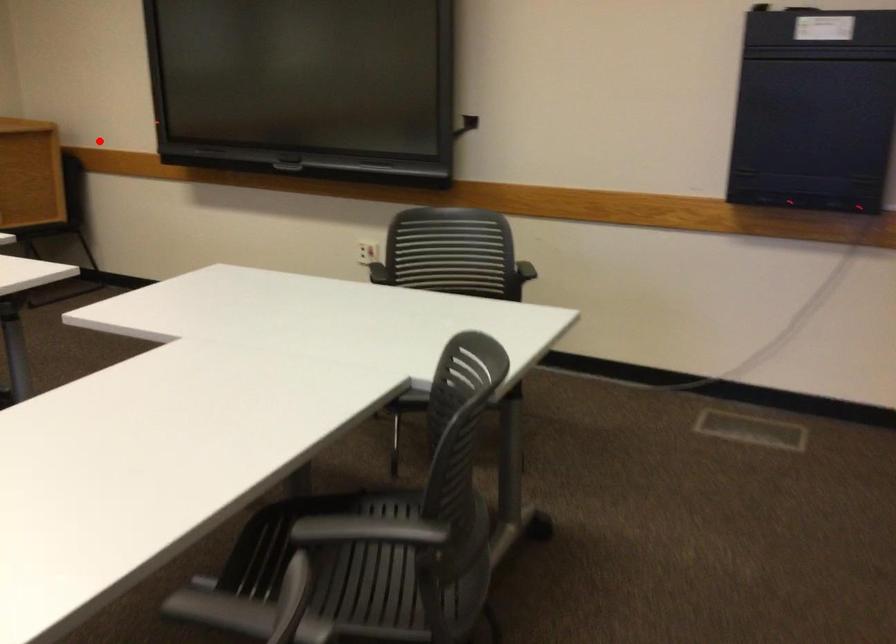
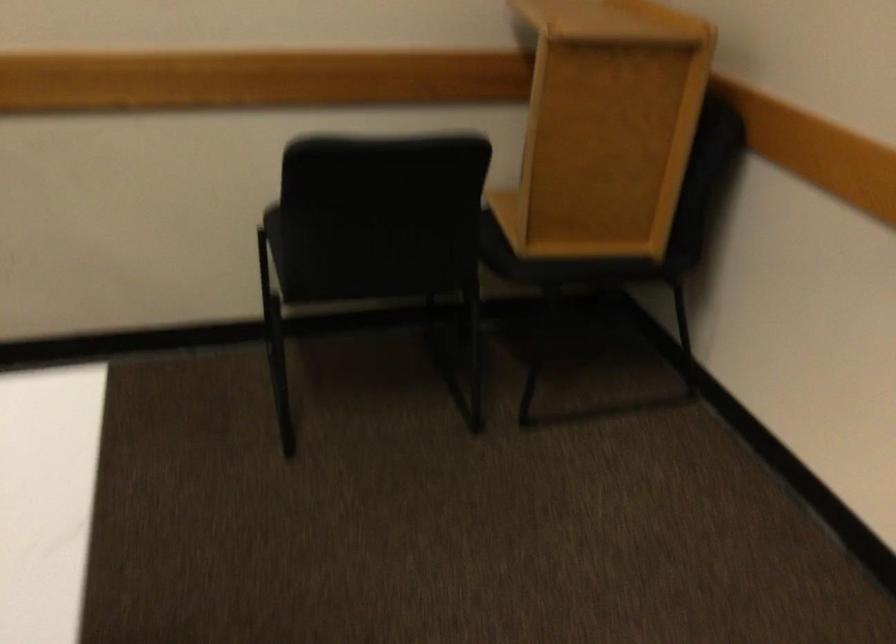
Question: A red point is marked in image1. In image2, is the corresponding 3D point closer to the camera or farther? Reply with the corresponding letter.

Choices:
 (A) The corresponding 3D point is closer.
 (B) The corresponding 3D point is farther.

Answer: (A)